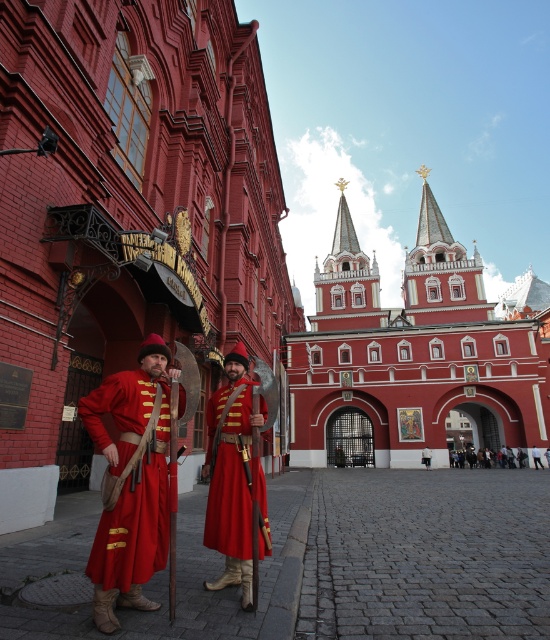
Is point (183, 406) positioned in front of point (485, 461)?

Yes.

Is matte red fabric at left smaller than red velvet coat at center?

Yes.

Where is `matte red fabric at left`? matte red fabric at left is located at coordinates (129, 481).

Identify the location of matte red fabric at left. The width and height of the screenshot is (550, 640). tap(129, 481).

Between smooth red stone gate at center and matte red fabric at left, which one has more height?

smooth red stone gate at center

The width and height of the screenshot is (550, 640). What are the coordinates of `smooth red stone gate at center` in the screenshot? It's located at (409, 356).

In order to click on smooth red stone gate at center in this screenshot , I will do `click(409, 356)`.

Does smooth red stone gate at center appear on the left side of matte red robe at center?

Incorrect, smooth red stone gate at center is not on the left side of matte red robe at center.

The height and width of the screenshot is (640, 550). I want to click on smooth red stone gate at center, so (409, 356).

Does point (345, 426) come behind point (217, 509)?

Yes.

The image size is (550, 640). I want to click on smooth red stone gate at center, so click(409, 356).